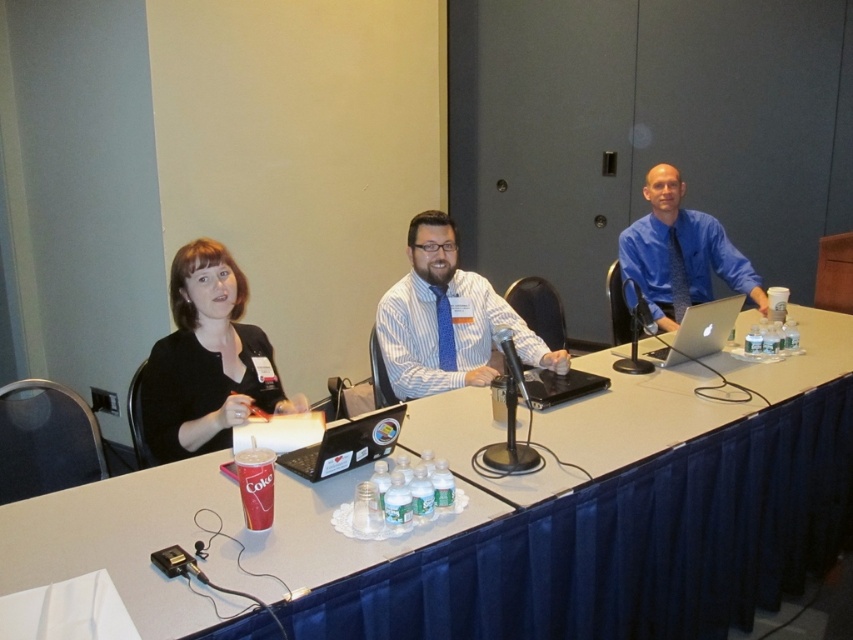
Between point (154, 412) and point (531, 348), which one is positioned behind?

The point (531, 348) is behind.

Does matte black shirt at left have a greater height compared to blue striped shirt at center?

No.

Is point (216, 332) closer to viewer compared to point (380, 310)?

Yes.

Where is `matte black shirt at left`? This screenshot has width=853, height=640. matte black shirt at left is located at coordinates (206, 358).

Can you confirm if white plastic table at center is wider than matte black shirt at left?

Indeed, white plastic table at center has a greater width compared to matte black shirt at left.

Is white plastic table at center taller than matte black shirt at left?

Yes.

Is point (344, 483) closer to camera compared to point (189, 276)?

Yes, point (344, 483) is in front of point (189, 276).

Where is `white plastic table at center`? white plastic table at center is located at coordinates (202, 536).

Does white plastic table at center have a lesser height compared to black matte laptop at center?

No, white plastic table at center is not shorter than black matte laptop at center.

Between point (570, 444) and point (334, 454), which one is positioned in front?

Positioned in front is point (334, 454).

I want to click on white plastic table at center, so click(202, 536).